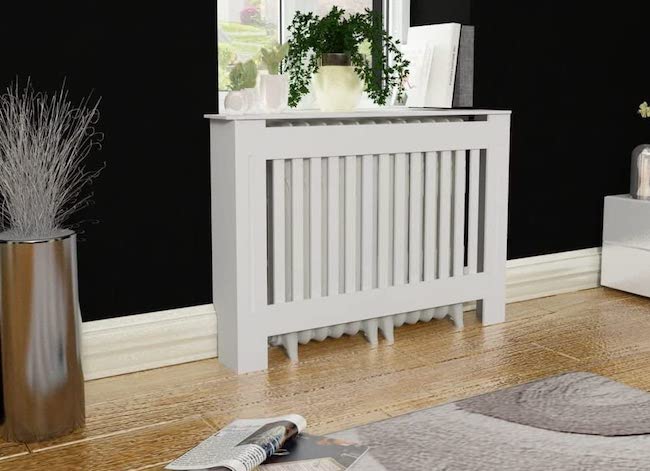
The height and width of the screenshot is (471, 650). In order to click on magazine in this screenshot , I will do `click(261, 439)`.